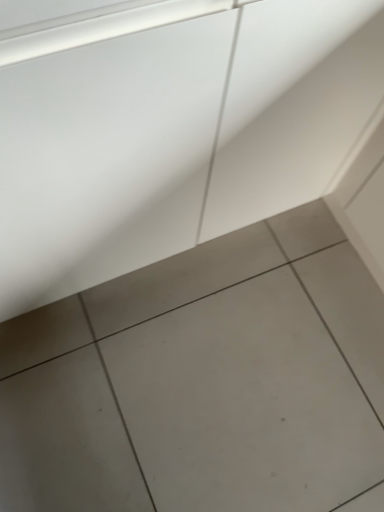
I want to click on gray matte tile at center, so click(245, 403).

The image size is (384, 512). What do you see at coordinates (245, 403) in the screenshot?
I see `gray matte tile at center` at bounding box center [245, 403].

At what (x,y) coordinates should I click in order to perform the action: click on white smooth concrete at center. Please return your answer as a coordinate pair (x, y). The image size is (384, 512). Looking at the image, I should click on (291, 108).

Describe the element at coordinates (291, 108) in the screenshot. I see `white smooth concrete at center` at that location.

Identify the location of gray matte tile at center. The image size is (384, 512). (245, 403).

Can you confirm if white smooth concrete at center is positioned to the left of gray matte tile at center?

In fact, white smooth concrete at center is to the right of gray matte tile at center.

Which object is further away from the camera taking this photo, white smooth concrete at center or gray matte tile at center?

gray matte tile at center is further away from the camera.

Which is further, (333, 94) or (243, 413)?

Point (243, 413)

From the image's perspective, which one is positioned lower, white smooth concrete at center or gray matte tile at center?

gray matte tile at center is shown below in the image.

From a real-world perspective, which is physically below, white smooth concrete at center or gray matte tile at center?

gray matte tile at center, from a real-world perspective.

Considering the sizes of objects white smooth concrete at center and gray matte tile at center in the image provided, who is thinner, white smooth concrete at center or gray matte tile at center?

Thinner between the two is white smooth concrete at center.

Between white smooth concrete at center and gray matte tile at center, which one has less height?

gray matte tile at center is shorter.

In terms of size, does white smooth concrete at center appear bigger or smaller than gray matte tile at center?

white smooth concrete at center is bigger than gray matte tile at center.

Is white smooth concrete at center spatially inside gray matte tile at center, or outside of it?

white smooth concrete at center is located beyond the bounds of gray matte tile at center.

Looking at this image, is white smooth concrete at center not close to gray matte tile at center?

No, white smooth concrete at center is not far from gray matte tile at center.

Is white smooth concrete at center aimed at gray matte tile at center?

Yes, white smooth concrete at center is oriented towards gray matte tile at center.

What's the angular difference between white smooth concrete at center and gray matte tile at center's facing directions?

white smooth concrete at center and gray matte tile at center are facing 1.46 degrees away from each other.

This screenshot has height=512, width=384. In order to click on concrete lying on the right of gray matte tile at center in this screenshot , I will do [291, 108].

Which is more to the left, gray matte tile at center or white smooth concrete at center?

gray matte tile at center.

Between gray matte tile at center and white smooth concrete at center, which one is positioned in front?

white smooth concrete at center is more forward.

Which point is more forward, (325, 328) or (354, 97)?

The point (354, 97) is more forward.

From the image's perspective, is gray matte tile at center positioned above or below white smooth concrete at center?

gray matte tile at center is situated lower than white smooth concrete at center in the image.

From a real-world perspective, who is located lower, gray matte tile at center or white smooth concrete at center?

gray matte tile at center, from a real-world perspective.

Between gray matte tile at center and white smooth concrete at center, which one has smaller width?

With smaller width is white smooth concrete at center.

Consider the image. Considering the relative sizes of gray matte tile at center and white smooth concrete at center in the image provided, is gray matte tile at center taller than white smooth concrete at center?

Incorrect, the height of gray matte tile at center is not larger of that of white smooth concrete at center.

Can you confirm if gray matte tile at center is smaller than white smooth concrete at center?

Yes, gray matte tile at center is smaller than white smooth concrete at center.

Would you say gray matte tile at center contains white smooth concrete at center?

No, white smooth concrete at center is located outside of gray matte tile at center.

Are gray matte tile at center and white smooth concrete at center far apart?

That's not correct — gray matte tile at center is a little close to white smooth concrete at center.

Is gray matte tile at center facing away from white smooth concrete at center?

No, gray matte tile at center is not facing the opposite direction of white smooth concrete at center.

Can you tell me how much gray matte tile at center and white smooth concrete at center differ in facing direction?

1.46 degrees separate the facing orientations of gray matte tile at center and white smooth concrete at center.

Measure the distance between gray matte tile at center and white smooth concrete at center.

gray matte tile at center and white smooth concrete at center are 21.31 inches apart.

This screenshot has height=512, width=384. What are the coordinates of `ceramic tile behind the white smooth concrete at center` in the screenshot? It's located at (245, 403).

Locate an element on the screen. This screenshot has height=512, width=384. concrete lying in front of the gray matte tile at center is located at coordinates [291, 108].

At what (x,y) coordinates should I click in order to perform the action: click on concrete that is above the gray matte tile at center (from a real-world perspective). Please return your answer as a coordinate pair (x, y). The width and height of the screenshot is (384, 512). Looking at the image, I should click on (291, 108).